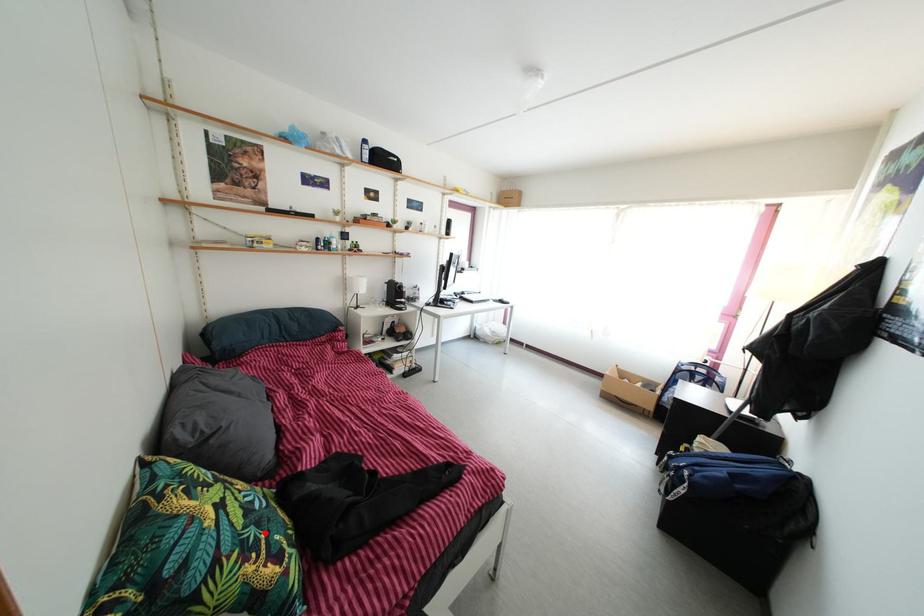
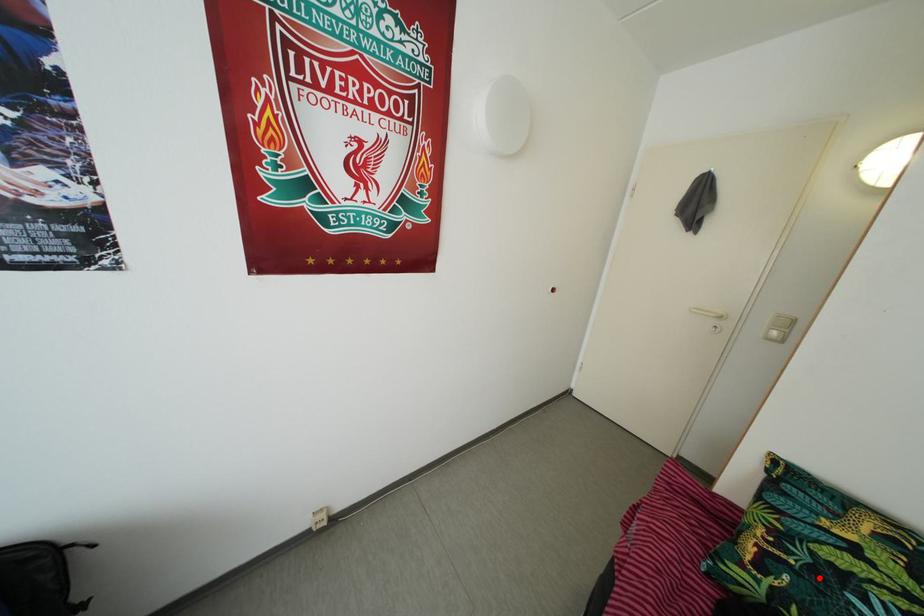
I am providing you with two images of the same scene from different viewpoints. A red point is marked on the first image and another point is marked on the second image. Is the marked point in image1 the same physical position as the marked point in image2?

Yes